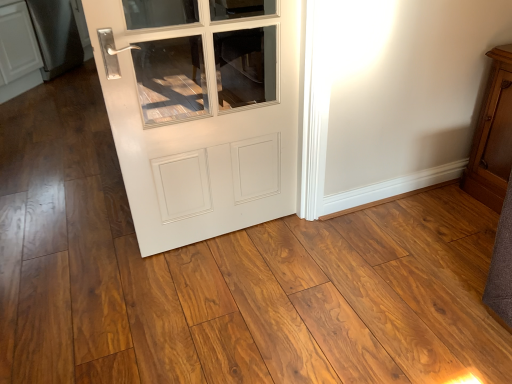
Question: From a real-world perspective, is white glossy door at center located beneath wooden cabinet at right?

Choices:
 (A) no
 (B) yes

Answer: (A)

Question: Does white glossy door at center have a lesser height compared to wooden cabinet at right?

Choices:
 (A) no
 (B) yes

Answer: (A)

Question: Is white glossy door at center facing away from wooden cabinet at right?

Choices:
 (A) yes
 (B) no

Answer: (B)

Question: From a real-world perspective, does white glossy door at center stand above wooden cabinet at right?

Choices:
 (A) no
 (B) yes

Answer: (B)

Question: Can you confirm if white glossy door at center is positioned to the left of wooden cabinet at right?

Choices:
 (A) no
 (B) yes

Answer: (B)

Question: From the image's perspective, would you say white glossy door at center is shown under wooden cabinet at right?

Choices:
 (A) yes
 (B) no

Answer: (A)

Question: Is wooden cabinet at right to the left of satin black refrigerator at left from the viewer's perspective?

Choices:
 (A) no
 (B) yes

Answer: (A)

Question: Is wooden cabinet at right not within satin black refrigerator at left?

Choices:
 (A) no
 (B) yes

Answer: (B)

Question: Is wooden cabinet at right positioned behind satin black refrigerator at left?

Choices:
 (A) no
 (B) yes

Answer: (A)

Question: From a real-world perspective, is wooden cabinet at right beneath satin black refrigerator at left?

Choices:
 (A) no
 (B) yes

Answer: (A)

Question: Can you confirm if wooden cabinet at right is bigger than satin black refrigerator at left?

Choices:
 (A) yes
 (B) no

Answer: (B)

Question: From a real-world perspective, is wooden cabinet at right over satin black refrigerator at left?

Choices:
 (A) yes
 (B) no

Answer: (A)

Question: From the image's perspective, is satin black refrigerator at left below wooden cabinet at right?

Choices:
 (A) no
 (B) yes

Answer: (A)